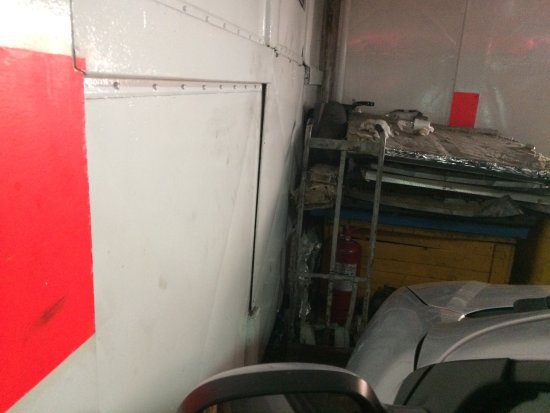
Where is `red reflection on wall`? This screenshot has height=413, width=550. red reflection on wall is located at coordinates tap(383, 34).